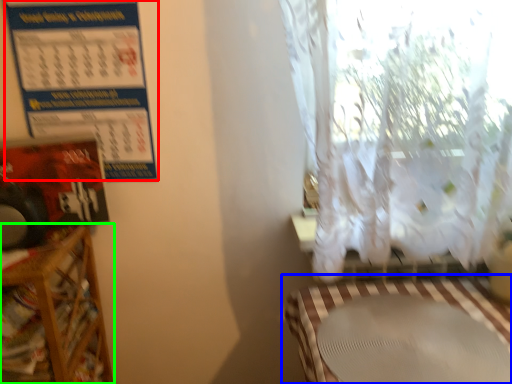
Question: Which object is positioned farthest from calendar (highlighted by a red box)? Select from table (highlighted by a blue box) and furniture (highlighted by a green box).

Choices:
 (A) table
 (B) furniture

Answer: (A)